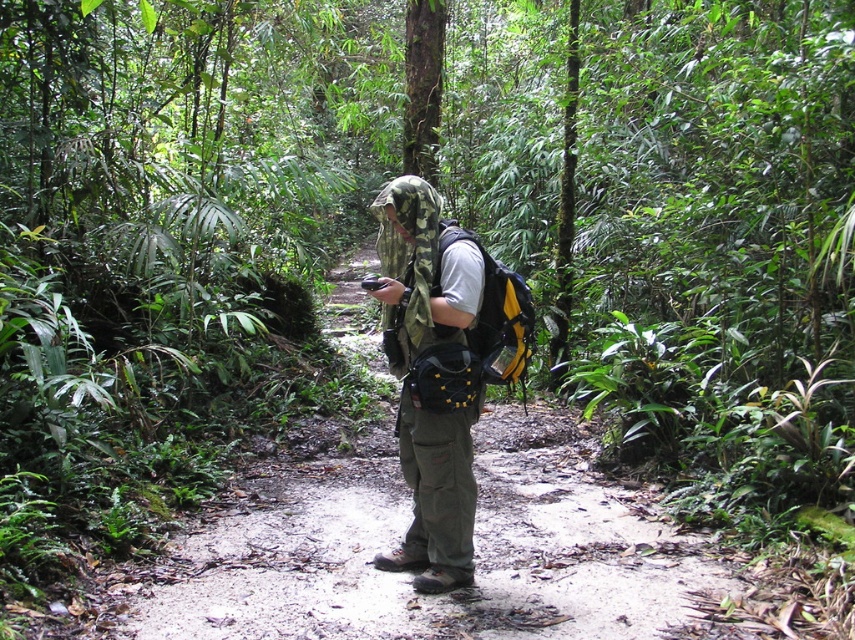
You are a hiker who wants to ensure your gear is properly arranged. Given the scene described, which of your items listed below is taller when viewed from the front? Please choose between the camouflage fabric hat at center and the yellow matte backpack at center.

The camouflage fabric hat at center is taller than the yellow matte backpack at center.

You are a hiker preparing to cross a narrow bridge in the jungle. You have two backpacks available to wear during the crossing. The dull green backpack at center and the yellow matte backpack at center. Which backpack should you choose if you want the one that is shorter in height?

The dull green backpack at center is not as tall as the yellow matte backpack at center, so you should choose the dull green backpack at center for the crossing.

You are a hiker trying to reach a hidden waterfall located behind the dull green backpack at center and the camouflage fabric hat at center. Which item should you move first to get to the waterfall?

You should move the dull green backpack at center first because it is closer to you than the camouflage fabric hat at center, so you need to move it first to access the area behind both items.